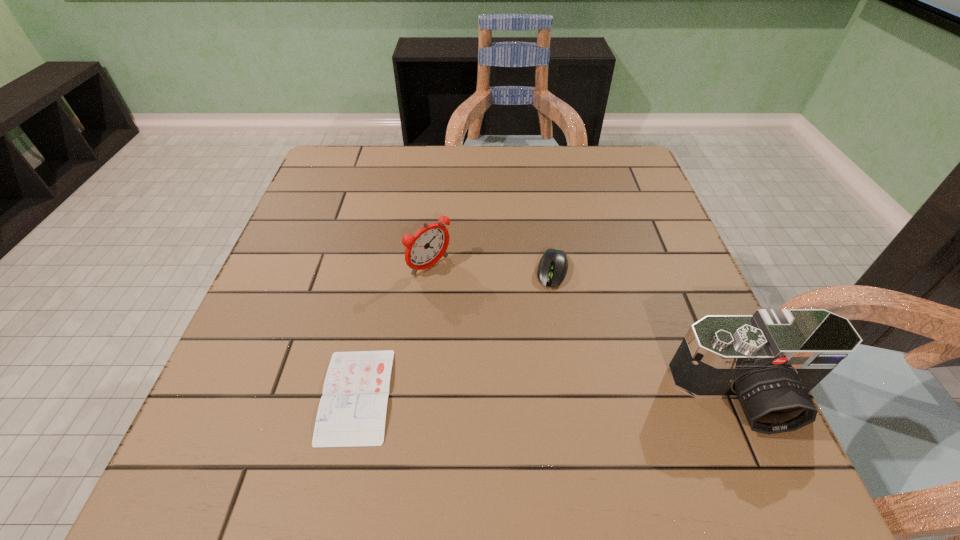
Identify the location of vacant space on the desktop that is between the diary and the camera and is positioned on the front-facing side of the third shortest object. (575, 395).

Locate an element on the screen. The width and height of the screenshot is (960, 540). vacant space on the desktop that is between the shortest object and the camera and is positioned on the wheel side of the second object from right to left is located at coordinates (522, 395).